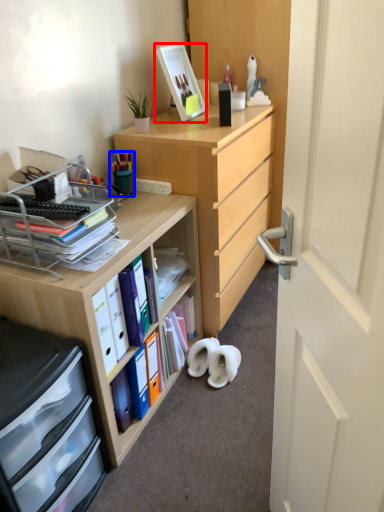
Question: Which object appears closest to the camera in this image, picture frame (highlighted by a red box) or stationery (highlighted by a blue box)?

Choices:
 (A) picture frame
 (B) stationery

Answer: (B)